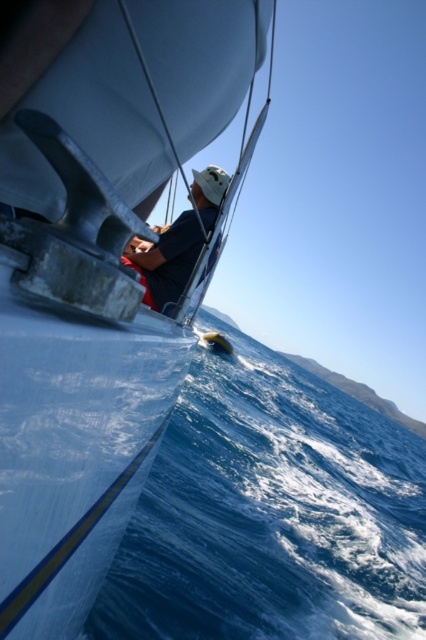
Does white matte sailboat at center come behind dark blue fabric at center?

Yes, it is behind dark blue fabric at center.

Where is `white matte sailboat at center`? The height and width of the screenshot is (640, 426). white matte sailboat at center is located at coordinates (97, 272).

Which is more to the right, blue water at lower left or dark blue fabric at center?

blue water at lower left

Image resolution: width=426 pixels, height=640 pixels. Describe the element at coordinates (270, 513) in the screenshot. I see `blue water at lower left` at that location.

Find the location of `blue water at lower left`. blue water at lower left is located at coordinates (270, 513).

Measure the distance between point (x=13, y=392) and camera.

23.08 inches

Can you confirm if white matte sailboat at center is positioned to the left of blue water at lower left?

Correct, you'll find white matte sailboat at center to the left of blue water at lower left.

Who is more distant from viewer, [5,221] or [379,474]?

Point [379,474]

Where is `white matte sailboat at center`? This screenshot has height=640, width=426. white matte sailboat at center is located at coordinates (97, 272).